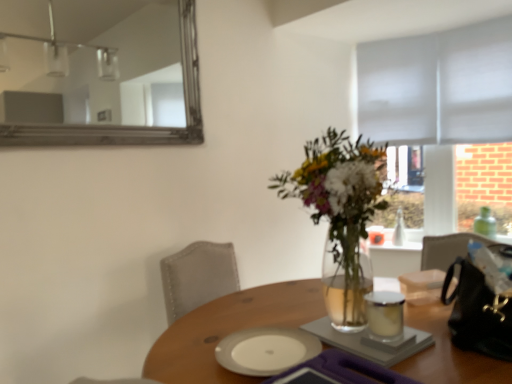
Question: Considering the positions of white ceramic plate at center, which is counted as the 1th tableware, starting from the left, and white glossy candle at center, marked as the second tableware in a bottom-to-top arrangement, in the image, is white ceramic plate at center, which is counted as the 1th tableware, starting from the left, taller or shorter than white glossy candle at center, marked as the second tableware in a bottom-to-top arrangement,?

Choices:
 (A) short
 (B) tall

Answer: (A)

Question: From a real-world perspective, is white ceramic plate at center, which is counted as the 1th tableware, starting from the left, positioned above or below white glossy candle at center, marked as the second tableware in a bottom-to-top arrangement?

Choices:
 (A) above
 (B) below

Answer: (B)

Question: Which of these objects is positioned farthest from the white ceramic plate at center, which is counted as the 2th tableware, starting from the top?

Choices:
 (A) gray fabric blind at upper right
 (B) wooden table at center
 (C) translucent glass vase at center
 (D) silver-framed mirror at upper left
 (E) white glossy candle at center, which is the 1th tableware from top to bottom

Answer: (D)

Question: Estimate the real-world distances between objects in this image. Which object is farther from the wooden table at center?

Choices:
 (A) white ceramic plate at center, marked as the 2th tableware in a right-to-left arrangement
 (B) white glossy candle at center, which is the 1th tableware from top to bottom
 (C) translucent glass vase at center
 (D) silver-framed mirror at upper left
 (E) gray fabric blind at upper right

Answer: (D)